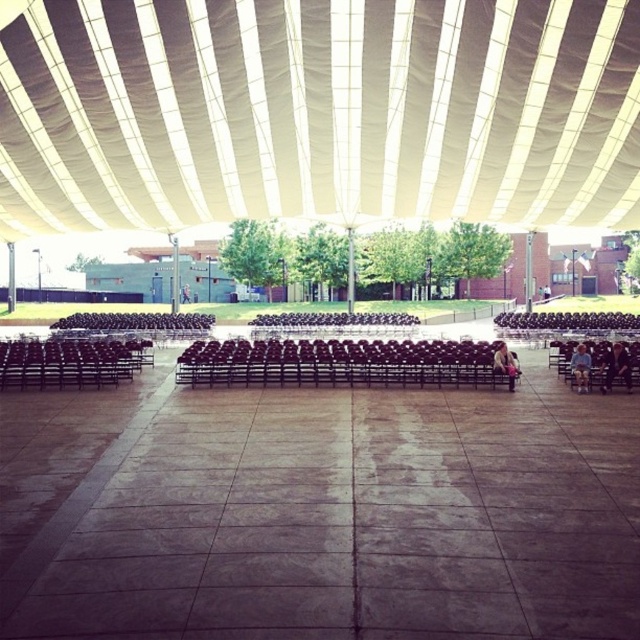
Can you confirm if white fabric canopy at upper center is smaller than white fabric person at center?

No.

Which is in front, point (312, 109) or point (188, 298)?

Point (312, 109) is in front.

Is point (588, 12) farther from viewer compared to point (184, 285)?

No, it is in front of (184, 285).

Locate an element on the screen. The image size is (640, 640). white fabric canopy at upper center is located at coordinates (317, 112).

Does dark brown leather jacket at lower right have a larger size compared to blue denim jeans at lower right?

Correct, dark brown leather jacket at lower right is larger in size than blue denim jeans at lower right.

Is dark brown leather jacket at lower right positioned before blue denim jeans at lower right?

Yes, it is in front of blue denim jeans at lower right.

Where is `dark brown leather jacket at lower right`? dark brown leather jacket at lower right is located at coordinates (616, 365).

Is point (99, 134) less distant than point (579, 378)?

No, it is not.

Locate an element on the screen. This screenshot has height=640, width=640. white fabric canopy at upper center is located at coordinates (317, 112).